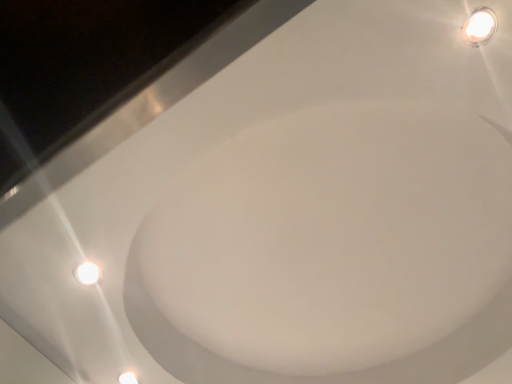
What do you see at coordinates (332, 252) in the screenshot? I see `white glossy bath at upper center` at bounding box center [332, 252].

Locate an element on the screen. The height and width of the screenshot is (384, 512). white glossy bath at upper center is located at coordinates (332, 252).

Measure the distance between white glossy light fixture at upper right and camera.

white glossy light fixture at upper right and camera are 29.37 inches apart.

Identify the location of white glossy light fixture at upper right. The image size is (512, 384). (479, 26).

Image resolution: width=512 pixels, height=384 pixels. Describe the element at coordinates (479, 26) in the screenshot. I see `white glossy light fixture at upper right` at that location.

Measure the distance between point (x=480, y=44) and camera.

Point (x=480, y=44) and camera are 30.24 inches apart.

In order to face white glossy light fixture at upper right, should I rotate leftwards or rightwards?

It's best to rotate right around 28.736 degrees.

I want to click on white glossy bath at upper center, so click(x=332, y=252).

Considering the positions of objects white glossy bath at upper center and white glossy light fixture at upper right in the image provided, who is more to the left, white glossy bath at upper center or white glossy light fixture at upper right?

Positioned to the left is white glossy bath at upper center.

Consider the image. Does white glossy bath at upper center come behind white glossy light fixture at upper right?

That is True.

Considering the points (426, 213) and (475, 18), which point is in front, point (426, 213) or point (475, 18)?

The point (475, 18) is in front.

From the image's perspective, between white glossy bath at upper center and white glossy light fixture at upper right, who is located below?

white glossy bath at upper center appears lower in the image.

From the picture: From a real-world perspective, is white glossy bath at upper center over white glossy light fixture at upper right?

Yes, from a real-world perspective, white glossy bath at upper center is over white glossy light fixture at upper right

Between white glossy bath at upper center and white glossy light fixture at upper right, which one has larger width?

With larger width is white glossy bath at upper center.

Is white glossy bath at upper center taller than white glossy light fixture at upper right?

In fact, white glossy bath at upper center may be shorter than white glossy light fixture at upper right.

Does white glossy bath at upper center have a smaller size compared to white glossy light fixture at upper right?

Actually, white glossy bath at upper center might be larger than white glossy light fixture at upper right.

Is white glossy bath at upper center surrounding white glossy light fixture at upper right?

No, white glossy light fixture at upper right is not inside white glossy bath at upper center.

Based on the photo, is white glossy bath at upper center placed right next to white glossy light fixture at upper right?

No, white glossy bath at upper center is not next to white glossy light fixture at upper right.

Based on the photo, could you tell me if white glossy bath at upper center is facing white glossy light fixture at upper right?

No.

What's the angular difference between white glossy bath at upper center and white glossy light fixture at upper right's facing directions?

The facing directions of white glossy bath at upper center and white glossy light fixture at upper right are 91.3 degrees apart.

This screenshot has height=384, width=512. What are the coordinates of `light fixture above the white glossy bath at upper center (from the image's perspective)` in the screenshot? It's located at (479, 26).

Between white glossy light fixture at upper right and white glossy bath at upper center, which one appears on the right side from the viewer's perspective?

From the viewer's perspective, white glossy light fixture at upper right appears more on the right side.

In the image, is white glossy light fixture at upper right positioned in front of or behind white glossy bath at upper center?

Clearly, white glossy light fixture at upper right is in front of white glossy bath at upper center.

Is point (496, 22) in front of point (332, 253)?

Yes.

From the image's perspective, is white glossy light fixture at upper right located above or below white glossy bath at upper center?

white glossy light fixture at upper right is above white glossy bath at upper center.

From a real-world perspective, is white glossy light fixture at upper right located beneath white glossy bath at upper center?

Indeed, from a real-world perspective, white glossy light fixture at upper right is positioned beneath white glossy bath at upper center.

Based on the photo, is white glossy light fixture at upper right wider than white glossy bath at upper center?

Incorrect, the width of white glossy light fixture at upper right does not surpass that of white glossy bath at upper center.

Considering the sizes of objects white glossy light fixture at upper right and white glossy bath at upper center in the image provided, who is taller, white glossy light fixture at upper right or white glossy bath at upper center?

Standing taller between the two is white glossy light fixture at upper right.

Which of these two, white glossy light fixture at upper right or white glossy bath at upper center, is bigger?

white glossy bath at upper center is bigger.

Would you say white glossy light fixture at upper right is inside or outside white glossy bath at upper center?

white glossy light fixture at upper right exists outside the volume of white glossy bath at upper center.

Is there a large distance between white glossy light fixture at upper right and white glossy bath at upper center?

No.

Is white glossy light fixture at upper right positioned with its back to white glossy bath at upper center?

That's not correct — white glossy light fixture at upper right is not looking away from white glossy bath at upper center.

Measure the distance between white glossy light fixture at upper right and white glossy bath at upper center.

white glossy light fixture at upper right and white glossy bath at upper center are 24.90 inches apart.

This screenshot has width=512, height=384. Identify the location of bath behind the white glossy light fixture at upper right. [x=332, y=252].

Find the location of a particular element. This screenshot has width=512, height=384. bath above the white glossy light fixture at upper right (from a real-world perspective) is located at coordinates (332, 252).

This screenshot has height=384, width=512. I want to click on light fixture located above the white glossy bath at upper center (from the image's perspective), so click(x=479, y=26).